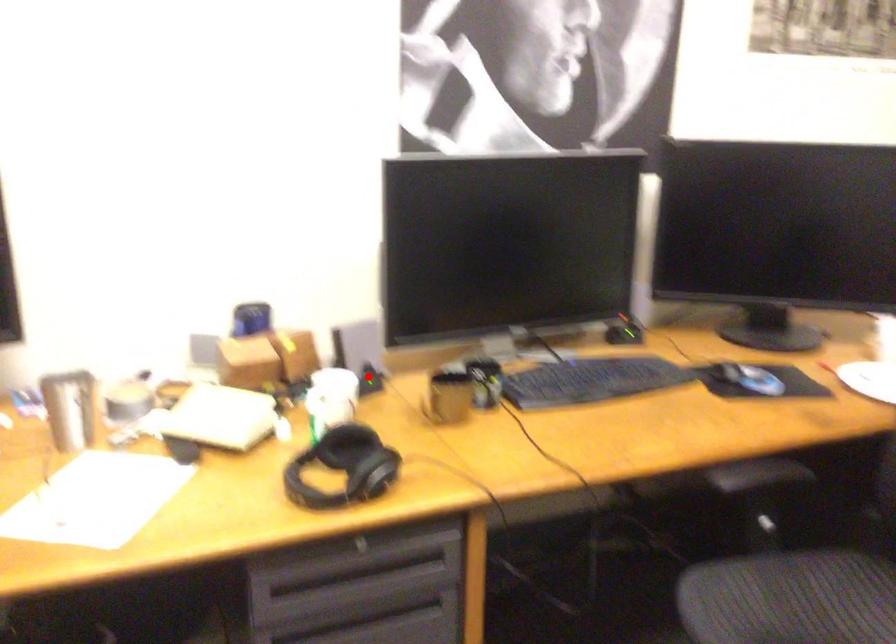
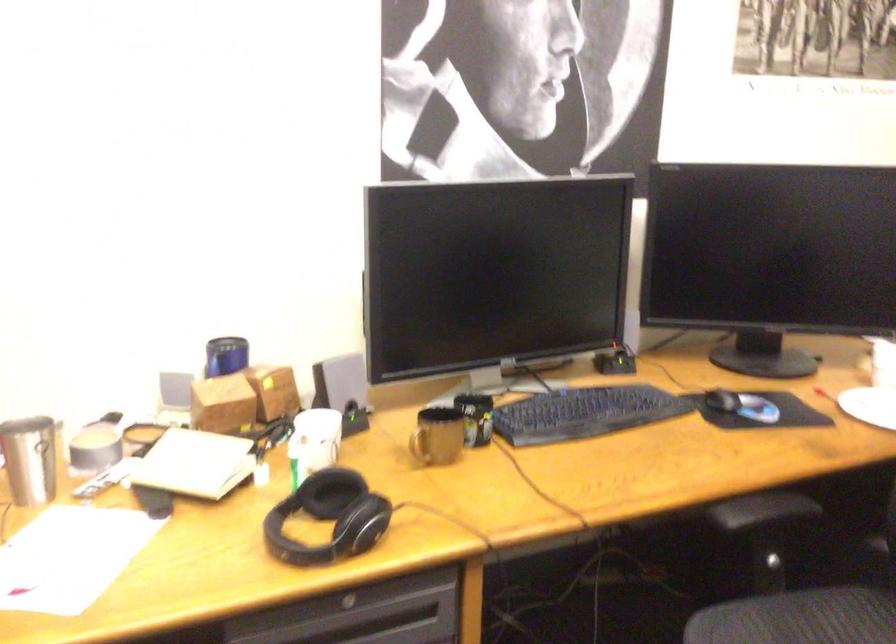
The point at the highlighted location is marked in the first image. Where is the corresponding point in the second image?

(352, 413)